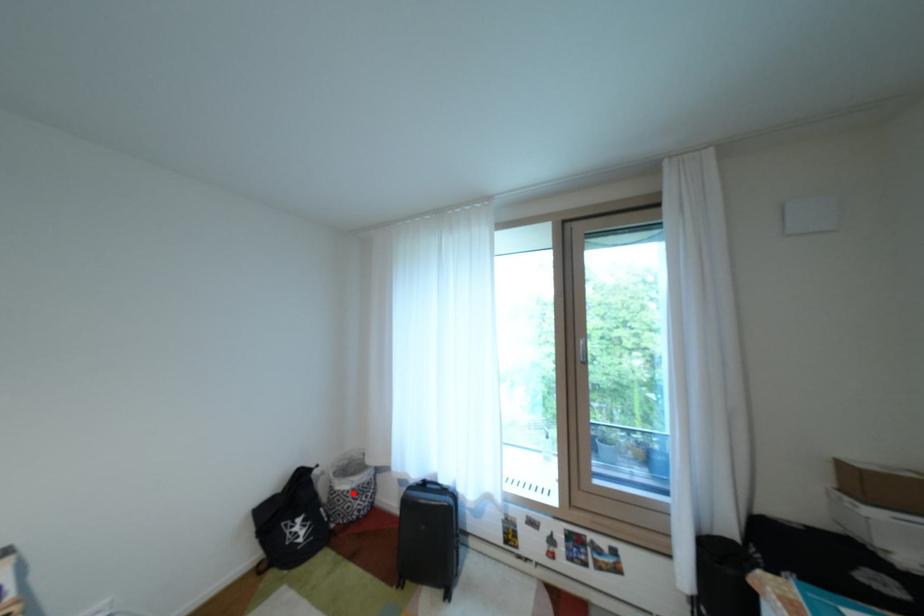
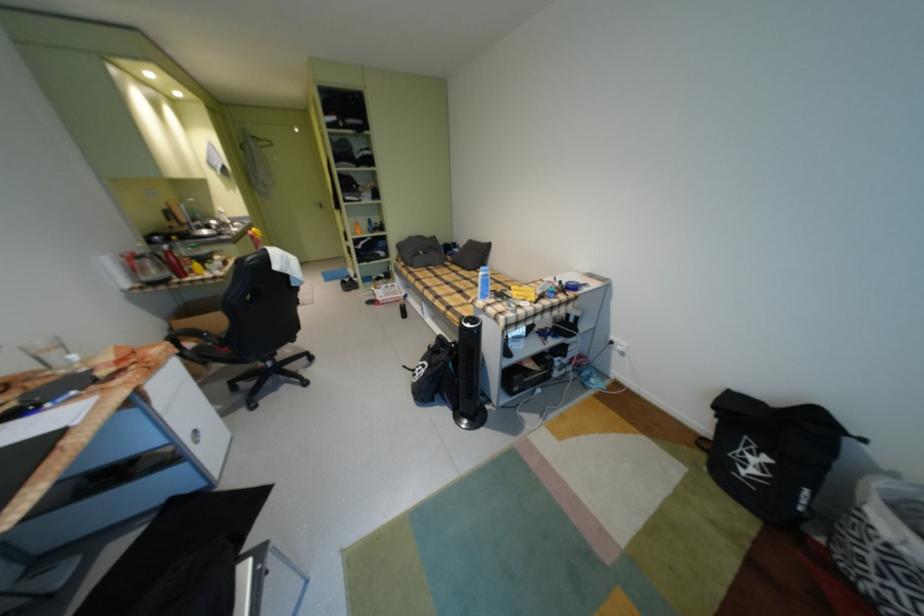
Find the pixel in the second image that matches the highlighted location in the first image.

(882, 529)